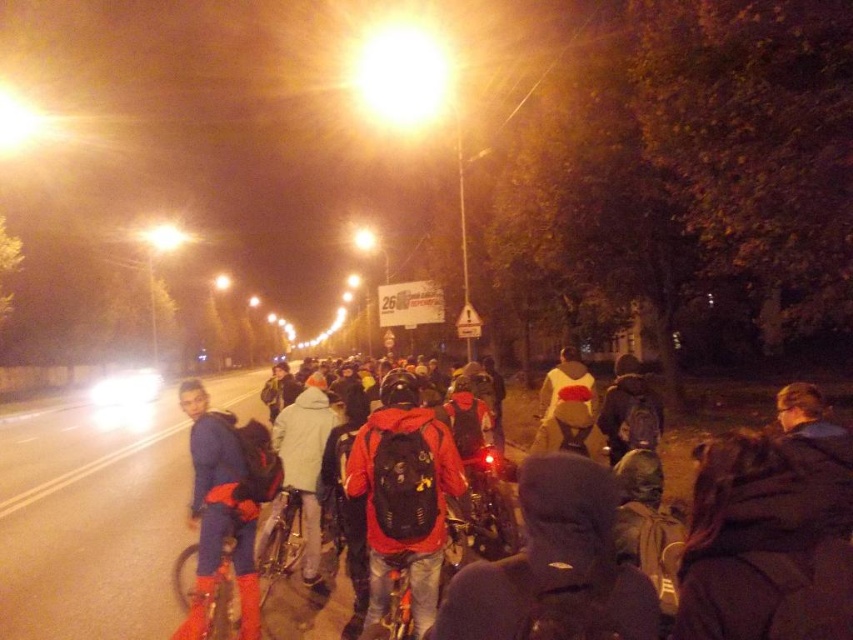
Consider the image. Between red backpack at center and matte red jacket at center, which one appears on the right side from the viewer's perspective?

Positioned to the right is red backpack at center.

Is red backpack at center thinner than matte red jacket at center?

Yes, red backpack at center is thinner than matte red jacket at center.

Is point (575, 596) positioned in front of point (416, 580)?

Yes.

The width and height of the screenshot is (853, 640). What are the coordinates of `red backpack at center` in the screenshot? It's located at (554, 566).

Does red backpack at center have a greater height compared to blue fabric jacket at left?

In fact, red backpack at center may be shorter than blue fabric jacket at left.

Can you confirm if red backpack at center is positioned below blue fabric jacket at left?

Actually, red backpack at center is above blue fabric jacket at left.

At what (x,y) coordinates should I click in order to perform the action: click on red backpack at center. Please return your answer as a coordinate pair (x, y). This screenshot has width=853, height=640. Looking at the image, I should click on click(554, 566).

In the scene shown: Between matte red jacket at center and blue fabric jacket at left, which one has more height?

With more height is blue fabric jacket at left.

Is point (393, 452) positioned before point (207, 480)?

Yes, it is in front of point (207, 480).

Where is `matte red jacket at center`? matte red jacket at center is located at coordinates (403, 496).